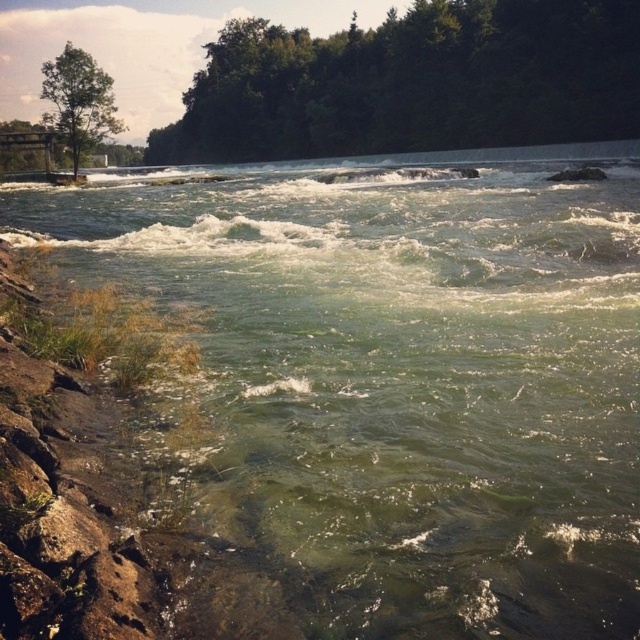
You are an environmental scientist observing the river scene. You need to determine which tree has a smaller width between the green leafy tree at upper center and the green matte tree at upper left. Which one is narrower?

The green leafy tree at upper center has a smaller width compared to the green matte tree at upper left, making it narrower.

You are a bird flying over the river scene. You want to land on the green leafy tree at upper center. Based on the coordinates provided, can you determine if the tree is located in the upper half of the image?

The green leafy tree at upper center is located at point coordinates of 0.130 in the x axis and 0.647 in the y axis. Since the y coordinate is above 0.5, it is in the upper half of the image. Therefore, the green leafy tree at upper center is indeed in the upper half of the image.